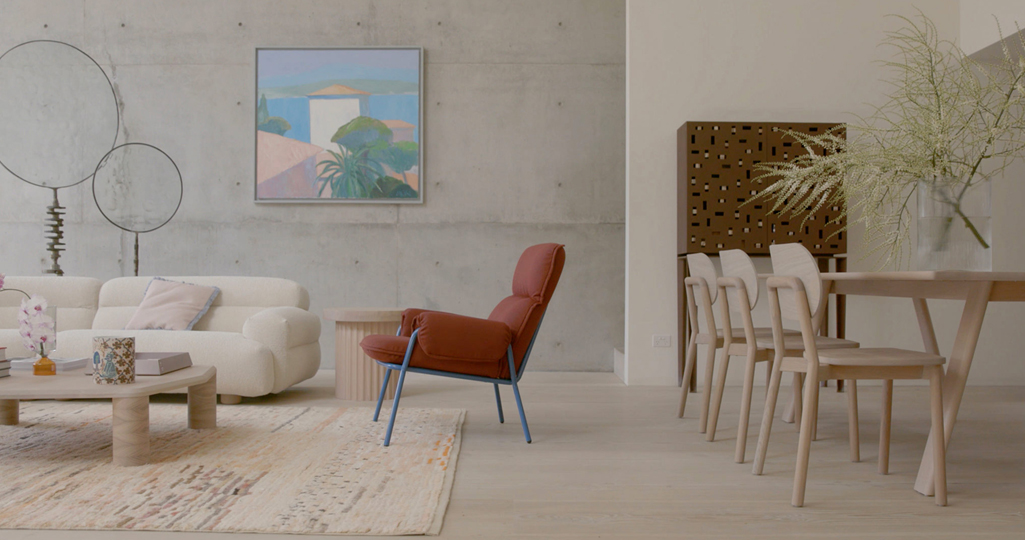
At what (x,y) coordinates should I click in order to perform the action: click on decorative branches. Please return your answer as a coordinate pair (x, y). This screenshot has width=1025, height=540. Looking at the image, I should click on coord(980,158), coord(935,98), coord(920,179).